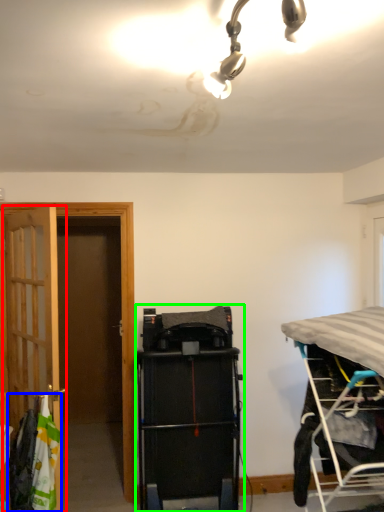
Question: Which object is positioned farthest from door (highlighted by a red box)? Select from laundry (highlighted by a blue box) and equipment (highlighted by a green box).

Choices:
 (A) laundry
 (B) equipment

Answer: (B)